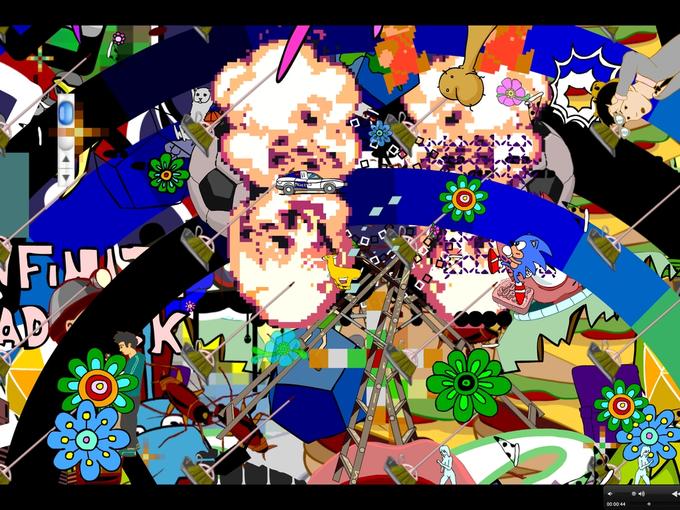
This screenshot has height=510, width=680. I want to click on ladder, so click(x=360, y=441), click(x=391, y=409), click(x=445, y=334), click(x=333, y=324).